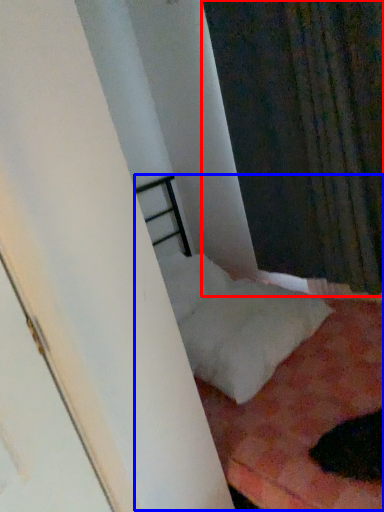
Question: Which object is further to the camera taking this photo, curtain (highlighted by a red box) or bed (highlighted by a blue box)?

Choices:
 (A) curtain
 (B) bed

Answer: (A)